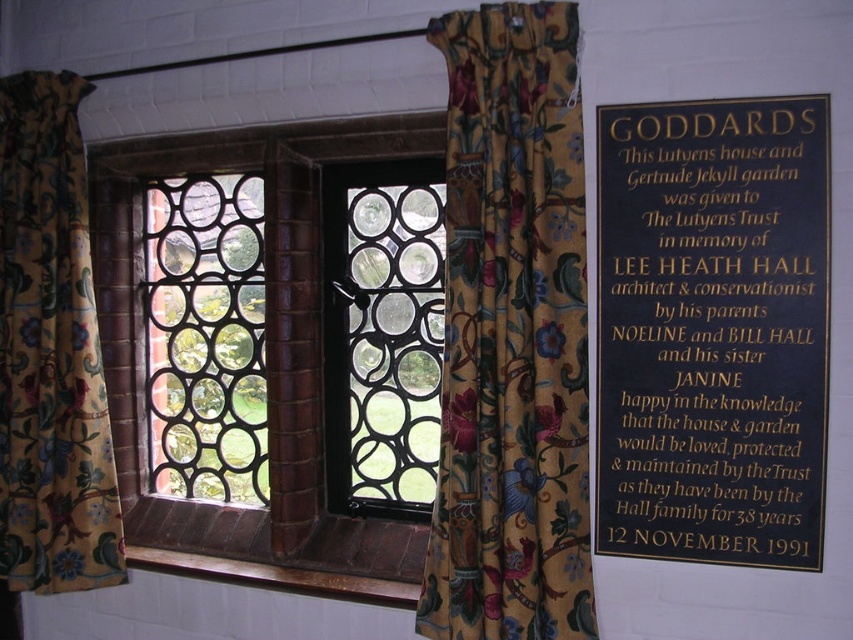
Question: Can you confirm if black polished stone plaque at right is positioned to the left of clear glass at center?

Choices:
 (A) no
 (B) yes

Answer: (A)

Question: Among these points, which one is farthest from the camera?

Choices:
 (A) (73, 561)
 (B) (688, 150)
 (C) (161, 224)

Answer: (C)

Question: Which is farther from the floral fabric curtain at left?

Choices:
 (A) floral-patterned fabric at center
 (B) black polished stone plaque at right
 (C) black metal/texture at center

Answer: (B)

Question: Based on their relative distances, which object is nearer to the floral fabric curtain at left?

Choices:
 (A) black ironwork window at center
 (B) black polished stone plaque at right
 (C) floral-patterned fabric at center
 (D) clear glass at center

Answer: (A)

Question: Does black polished stone plaque at right appear on the right side of clear glass at center?

Choices:
 (A) yes
 (B) no

Answer: (A)

Question: Can you confirm if floral fabric curtain at left is bigger than clear glass at center?

Choices:
 (A) no
 (B) yes

Answer: (A)